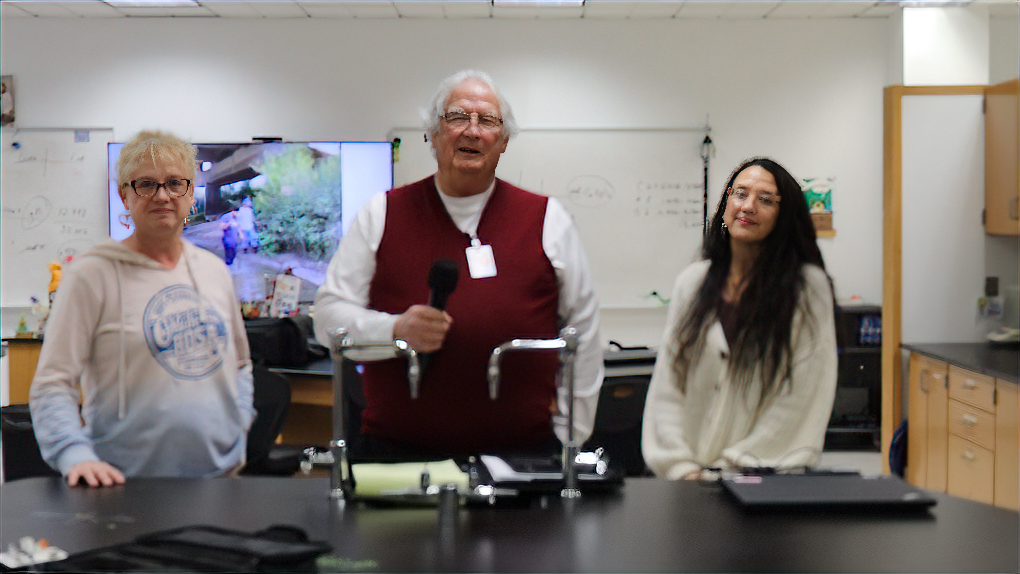
Where is `faucet`? The image size is (1020, 574). faucet is located at coordinates (410, 363), (518, 343).